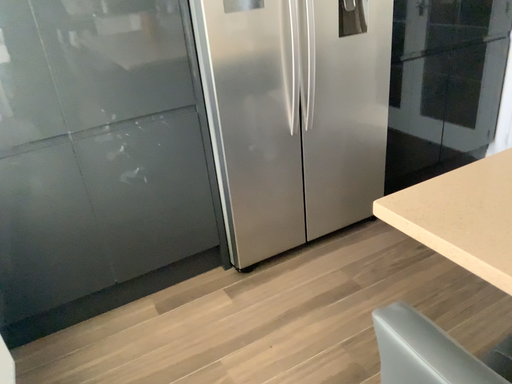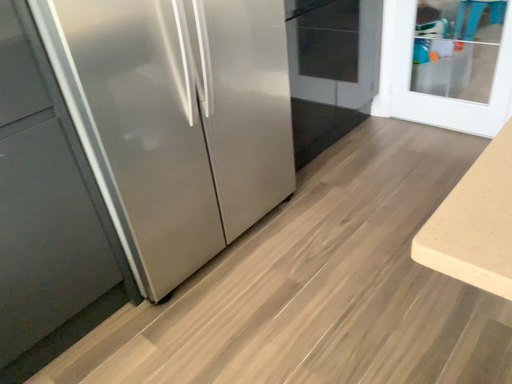
Question: Which way did the camera rotate in the video?

Choices:
 (A) rotated right
 (B) rotated left

Answer: (A)